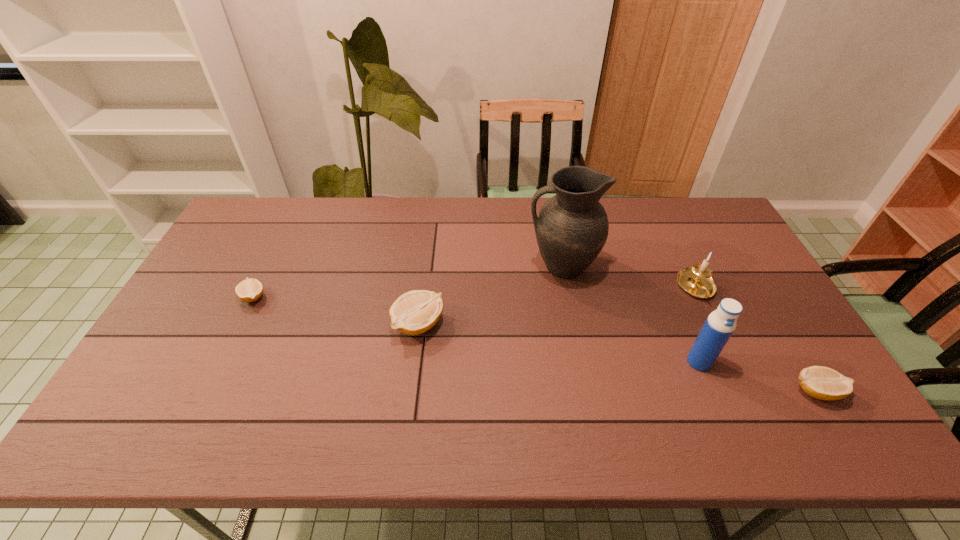
To achieve even spacing by inserting another lemon among them, please point to a vacant spot for this new lemon. Please provide its 2D coordinates. Your answer should be formatted as a tuple, i.e. [(x, y)], where the tuple contains the x and y coordinates of a point satisfying the conditions above.

[(605, 355)]